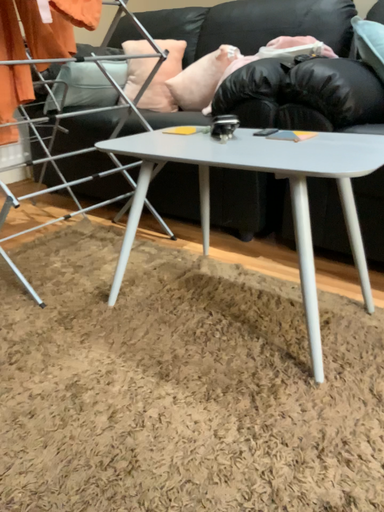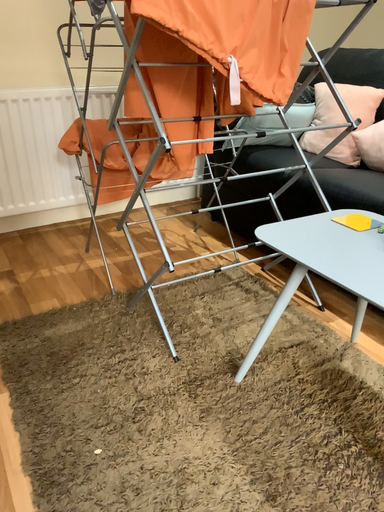
Question: Which way did the camera rotate in the video?

Choices:
 (A) rotated right
 (B) rotated left

Answer: (B)